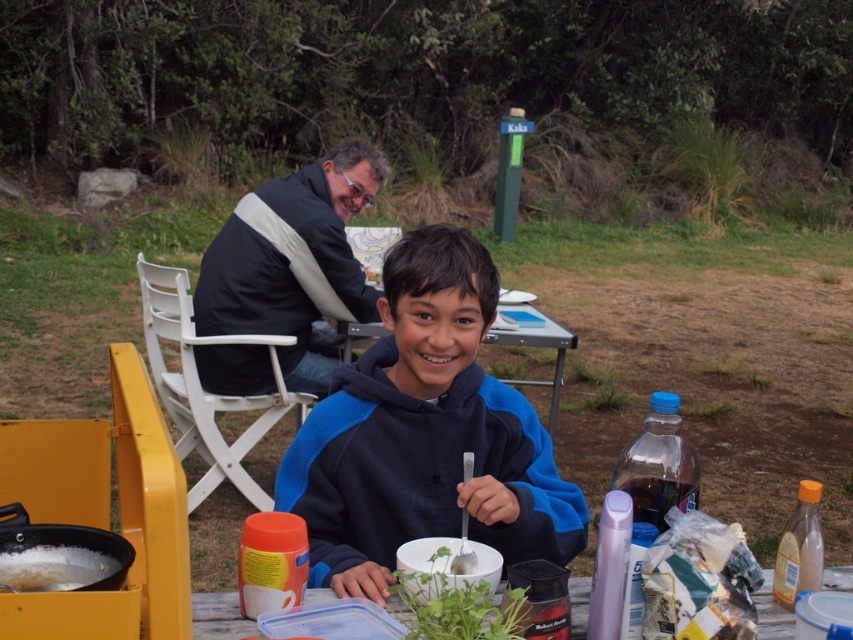
Does clear plastic container at center have a larger size compared to white matte pot at lower left?

Indeed, clear plastic container at center has a larger size compared to white matte pot at lower left.

Who is taller, clear plastic container at center or white matte pot at lower left?

clear plastic container at center is taller.

Where is `clear plastic container at center`? The height and width of the screenshot is (640, 853). clear plastic container at center is located at coordinates pos(219,616).

From the picture: Is dark blue jacket at upper left shorter than white plastic picnic table at center?

No, dark blue jacket at upper left is not shorter than white plastic picnic table at center.

Is dark blue jacket at upper left in front of white plastic picnic table at center?

No, it is not.

Between point (270, 188) and point (529, 296), which one is positioned behind?

Positioned behind is point (529, 296).

At what (x,y) coordinates should I click in order to perform the action: click on dark blue jacket at upper left. Please return your answer as a coordinate pair (x, y). Looking at the image, I should click on [293, 262].

Which of these two, white matte pot at lower left or white plastic picnic table at center, stands shorter?

white matte pot at lower left

Who is positioned more to the right, white matte pot at lower left or white plastic picnic table at center?

Positioned to the right is white plastic picnic table at center.

Who is more distant from viewer, [115,557] or [556,339]?

Positioned behind is point [556,339].

I want to click on white matte pot at lower left, so click(x=61, y=566).